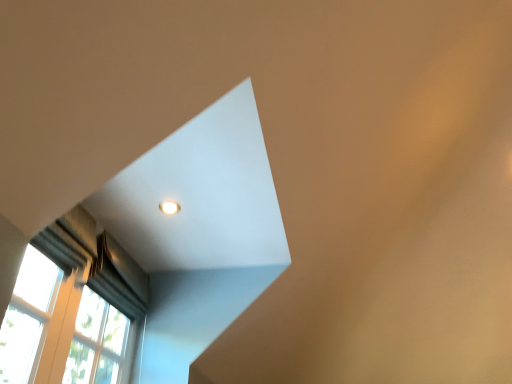
Question: From their relative heights in the image, would you say dark gray textured curtain at left is taller or shorter than white glossy light fixture at upper center?

Choices:
 (A) tall
 (B) short

Answer: (A)

Question: Considering the positions of dark gray textured curtain at left and white glossy light fixture at upper center in the image, is dark gray textured curtain at left bigger or smaller than white glossy light fixture at upper center?

Choices:
 (A) small
 (B) big

Answer: (B)

Question: Is point (125, 271) closer or farther from the camera than point (172, 211)?

Choices:
 (A) closer
 (B) farther

Answer: (B)

Question: From a real-world perspective, is white glossy light fixture at upper center physically located above or below dark gray textured curtain at left?

Choices:
 (A) below
 (B) above

Answer: (B)

Question: Is white glossy light fixture at upper center bigger or smaller than dark gray textured curtain at left?

Choices:
 (A) small
 (B) big

Answer: (A)

Question: Would you say white glossy light fixture at upper center is to the left or to the right of dark gray textured curtain at left in the picture?

Choices:
 (A) right
 (B) left

Answer: (A)

Question: Does point (169, 213) appear closer or farther from the camera than point (112, 264)?

Choices:
 (A) closer
 (B) farther

Answer: (A)